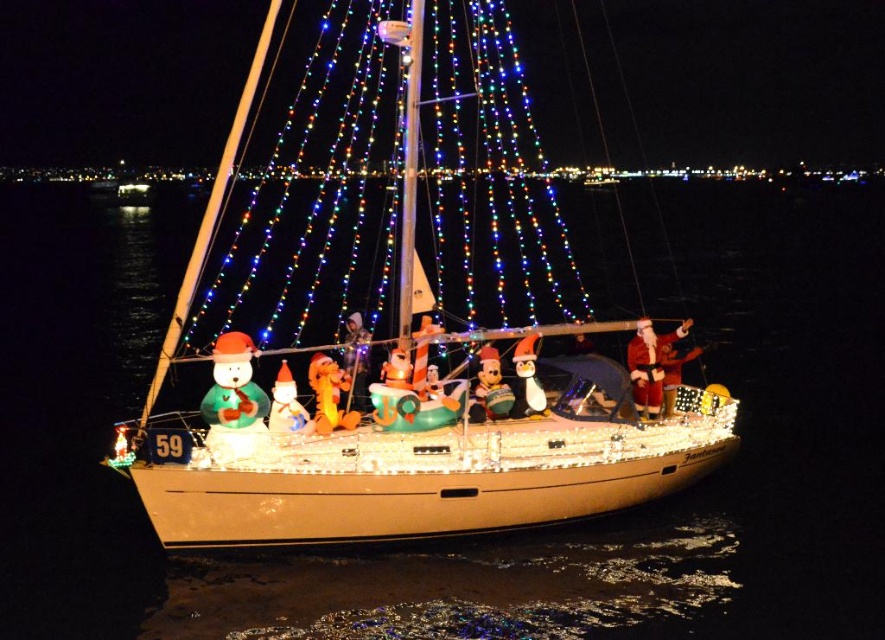
Question: Which of the following is the farthest from the observer?

Choices:
 (A) white glossy sailboat at center
 (B) green matte snowman at center
 (C) glossy plastic reindeer at center
 (D) clear water at center

Answer: (C)

Question: Which point is farther from the camera taking this photo?

Choices:
 (A) (289, 419)
 (B) (278, 4)
 (C) (460, 148)

Answer: (C)

Question: In this image, where is white glossy sailboat at center located relative to matte plastic penguin at center?

Choices:
 (A) left
 (B) right

Answer: (A)

Question: Can you confirm if matte plastic snowman at center is thinner than matte plastic penguin at center?

Choices:
 (A) yes
 (B) no

Answer: (B)

Question: Can you confirm if white glossy sailboat at center is positioned to the left of matte plastic snowman at center?

Choices:
 (A) yes
 (B) no

Answer: (B)

Question: Among these objects, which one is nearest to the camera?

Choices:
 (A) shiny plastic mickey mouse at center
 (B) matte plastic snowman at center
 (C) matte plastic penguin at center
 (D) glossy plastic reindeer at center

Answer: (B)